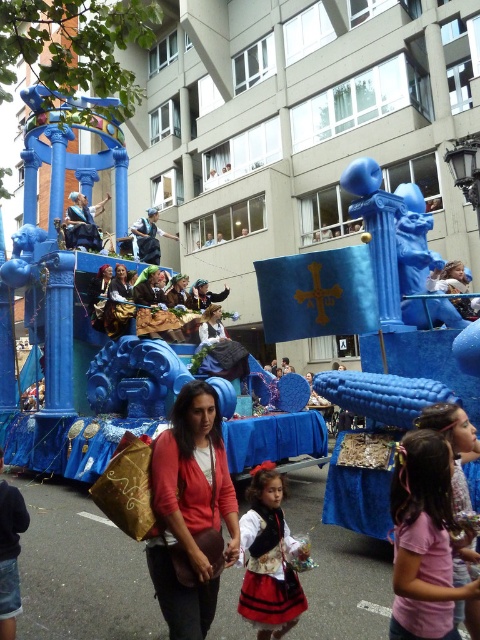
Question: Can you confirm if matte black dress at center is positioned to the left of matte gold dress at center?

Choices:
 (A) no
 (B) yes

Answer: (A)

Question: Which point is farther from the camera taking this photo?

Choices:
 (A) (248, 582)
 (B) (459, 600)
 (C) (117, 337)
 (D) (197, 404)

Answer: (C)

Question: Is pink fabric dress at lower center smaller than matte gold dress at center?

Choices:
 (A) no
 (B) yes

Answer: (A)

Question: Which object is farther from the camera taking this photo?

Choices:
 (A) pink fabric dress at lower center
 (B) matte black dress at center
 (C) matte gold dress at center

Answer: (C)

Question: Which point appears closest to the camera in this image?

Choices:
 (A) (129, 298)
 (B) (272, 529)
 (C) (408, 634)

Answer: (C)

Question: Observing the image, what is the correct spatial positioning of matte red sweater at center in reference to matte black dress at center?

Choices:
 (A) above
 (B) below

Answer: (A)